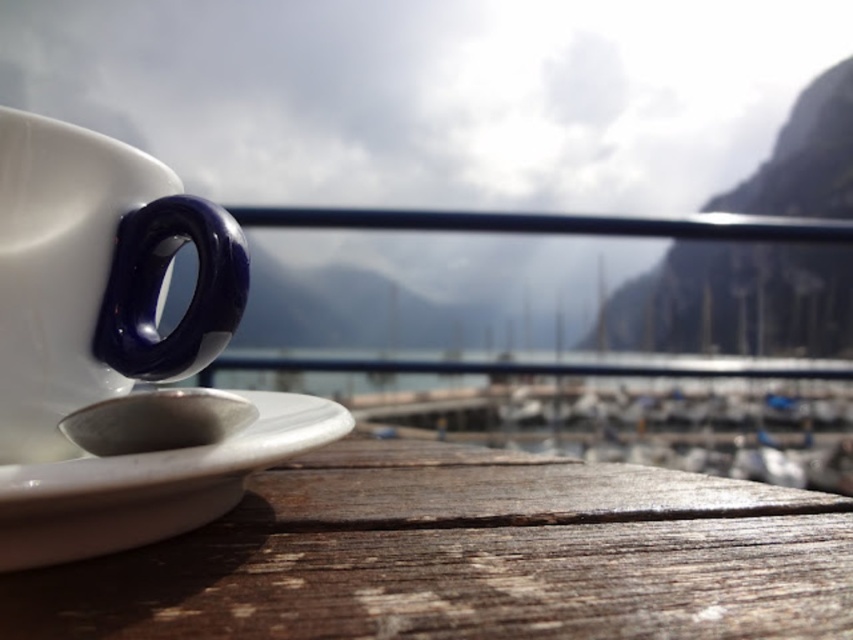
Question: From the image, what is the correct spatial relationship of wooden table at lower left in relation to white glossy saucer at lower left?

Choices:
 (A) below
 (B) above

Answer: (A)

Question: Which of the following is the closest to the observer?

Choices:
 (A) white glossy saucer at lower left
 (B) wooden table at lower left
 (C) white glossy mug at left

Answer: (B)

Question: Considering the real-world distances, which object is closest to the white glossy saucer at lower left?

Choices:
 (A) wooden table at lower left
 (B) white glossy mug at left

Answer: (B)

Question: Does white glossy mug at left appear over white glossy saucer at lower left?

Choices:
 (A) yes
 (B) no

Answer: (A)

Question: Among these points, which one is nearest to the camera?

Choices:
 (A) (102, 333)
 (B) (397, 532)

Answer: (B)

Question: Can you confirm if wooden table at lower left is positioned above white glossy saucer at lower left?

Choices:
 (A) no
 (B) yes

Answer: (A)